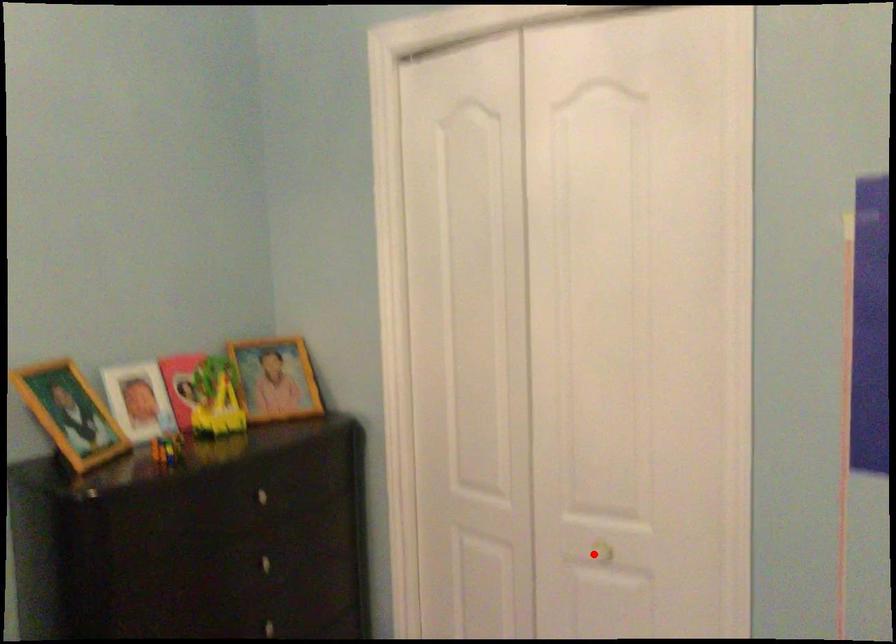
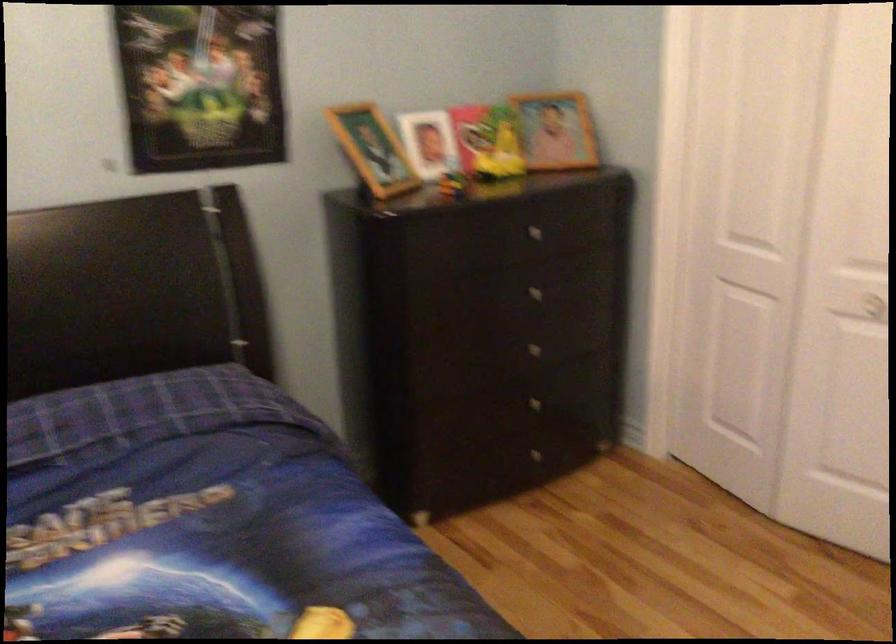
Where in the second image is the point corresponding to the highlighted location from the first image?

(864, 305)